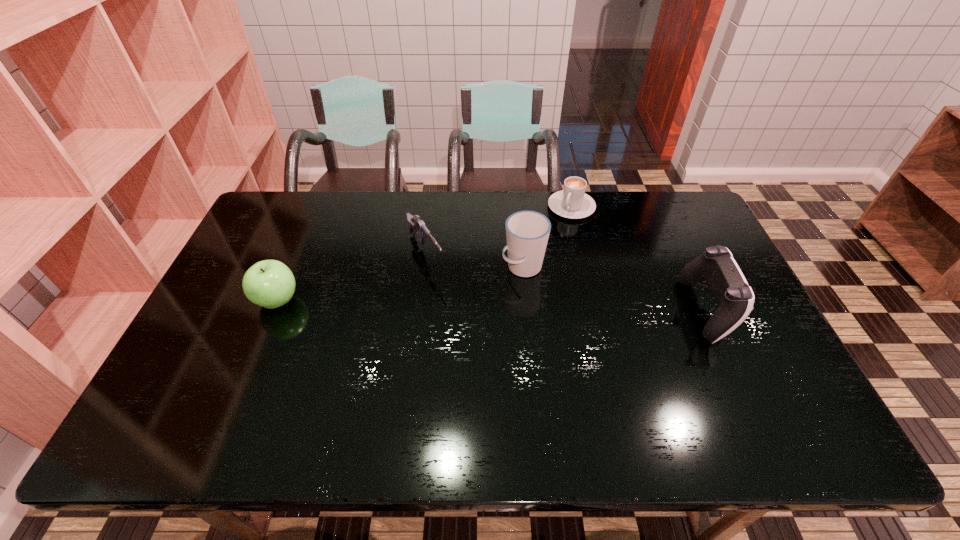
Where is `free space on the desktop that is between the apple and the control and is positioned at the barrel of the gun`? This screenshot has width=960, height=540. free space on the desktop that is between the apple and the control and is positioned at the barrel of the gun is located at coordinates (461, 305).

Find the location of a particular element. free space on the desktop that is between the leftmost object and the control and is positioned to the right of the second object from right to left is located at coordinates (509, 305).

Find the location of a particular element. vacant space on the desktop that is between the leftmost object and the rightmost object and is positioned with a handle on the side of the cup is located at coordinates (463, 305).